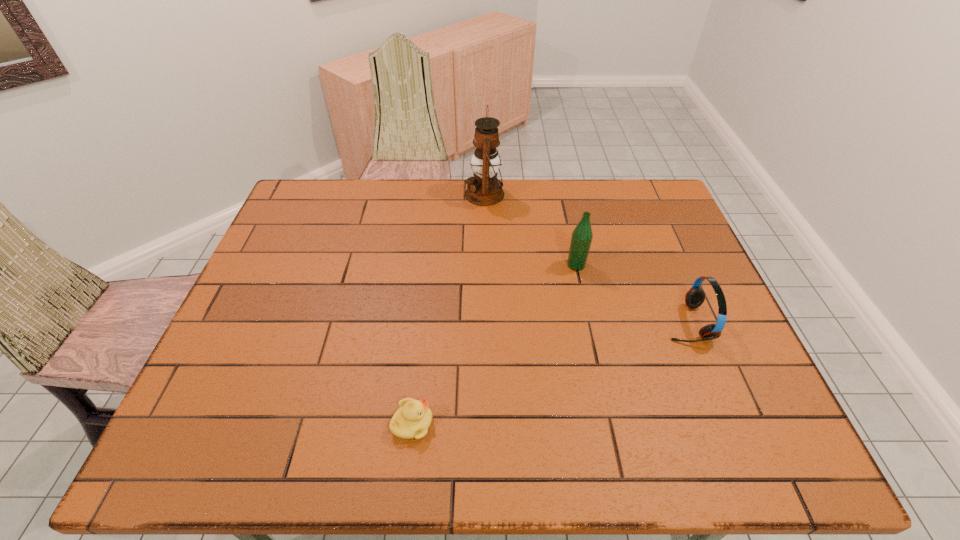
Where is `lantern`? lantern is located at coordinates (484, 189).

This screenshot has width=960, height=540. I want to click on the third object from right to left, so click(x=484, y=189).

Locate an element on the screen. The width and height of the screenshot is (960, 540). the second tallest object is located at coordinates (581, 239).

Find the location of a particular element. The height and width of the screenshot is (540, 960). bottle is located at coordinates (581, 239).

What are the coordinates of `the rightmost object` in the screenshot? It's located at (695, 297).

Find the location of a particular element. The height and width of the screenshot is (540, 960). the second nearest object is located at coordinates (695, 297).

This screenshot has height=540, width=960. Identify the location of the leftmost object. (413, 418).

Locate an element on the screen. the nearest object is located at coordinates (413, 418).

Where is `vacant space located 0.090m on the side of the second object from left to right, there is a wick adjustment knob`? vacant space located 0.090m on the side of the second object from left to right, there is a wick adjustment knob is located at coordinates (439, 194).

Identify the location of free space located 0.230m on the side of the second object from left to right, there is a wick adjustment knob. This screenshot has height=540, width=960. (397, 194).